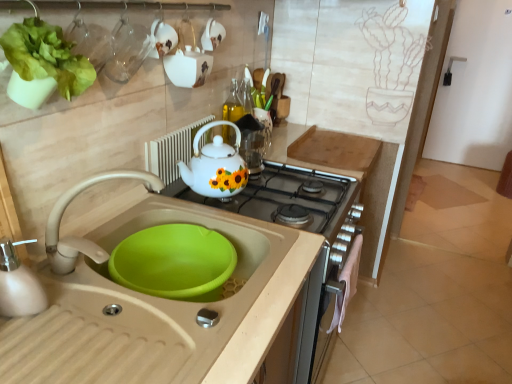
This screenshot has height=384, width=512. I want to click on vacant area that lies in front of matte beige faucet at sink left, so click(94, 331).